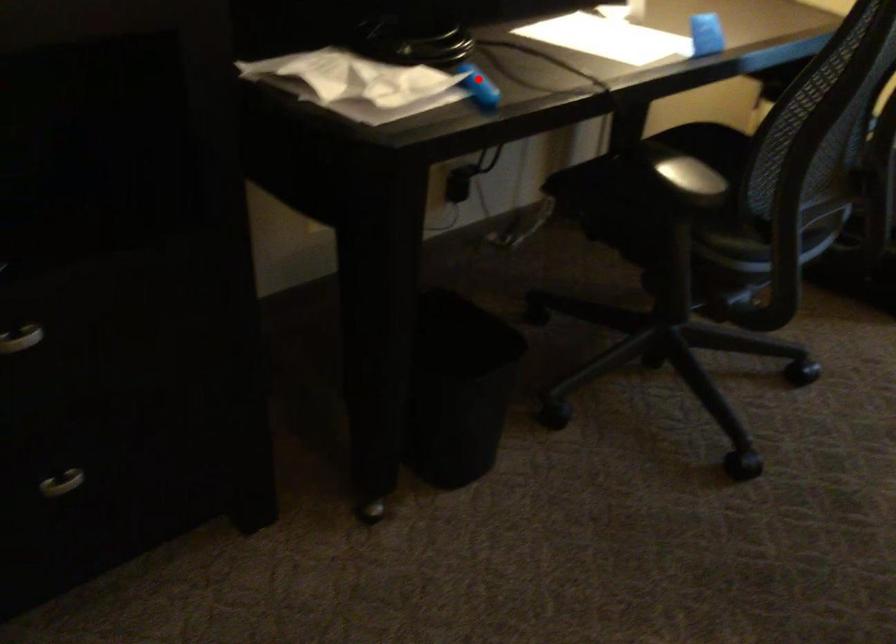
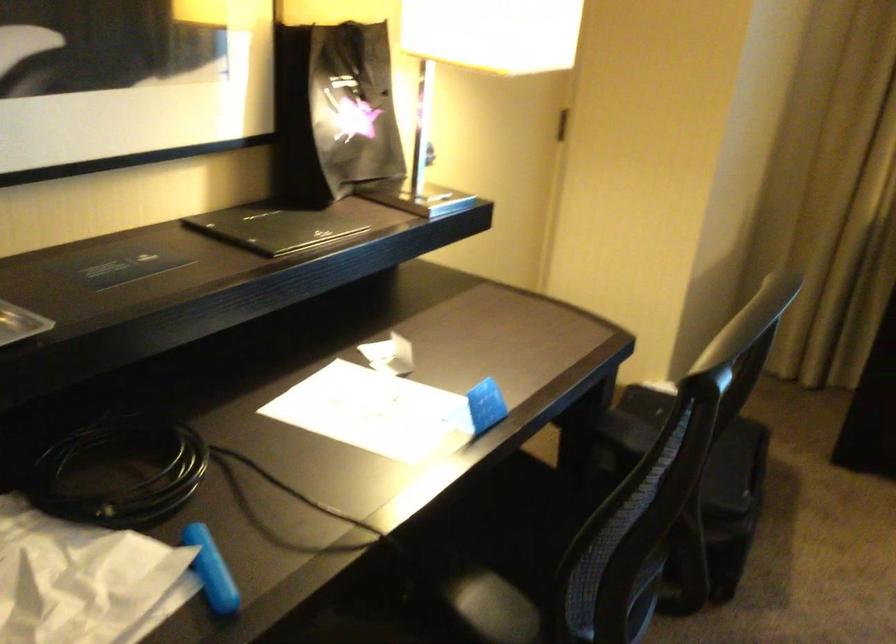
Question: A red point is marked in image1. In image2, is the corresponding 3D point closer to the camera or farther? Reply with the corresponding letter.

Choices:
 (A) The corresponding 3D point is closer.
 (B) The corresponding 3D point is farther.

Answer: (A)